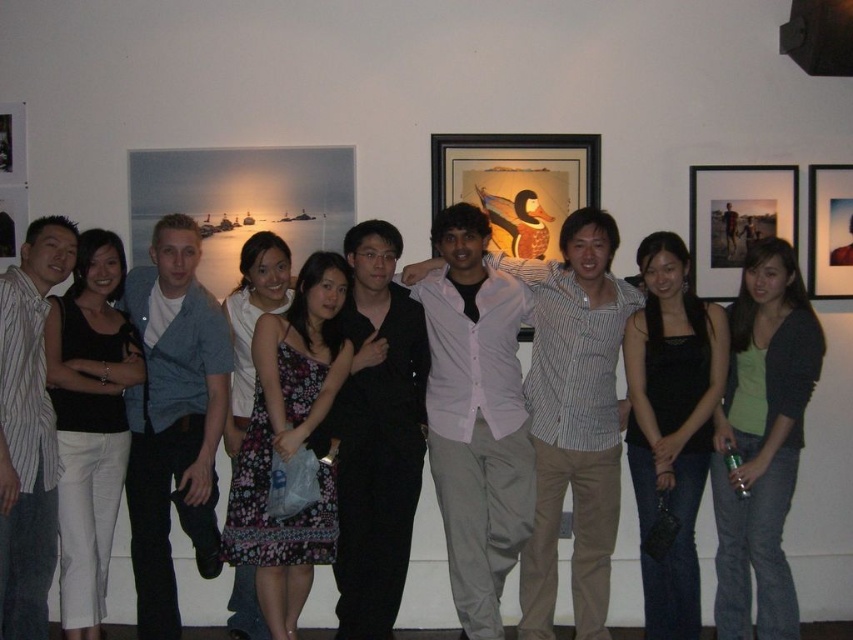
Between pink button-up shirt at center and black satin tank top at center, which one appears on the left side from the viewer's perspective?

pink button-up shirt at center

Is point (622, 321) positioned behind point (676, 468)?

Yes, point (622, 321) is behind point (676, 468).

I want to click on pink button-up shirt at center, so click(x=573, y=419).

Does black satin tank top at center appear under matte black portrait at upper right?

Yes.

Is black satin tank top at center closer to the viewer compared to matte black portrait at upper right?

→ Yes, black satin tank top at center is in front of matte black portrait at upper right.

At what (x,y) coordinates should I click in order to perform the action: click on black satin tank top at center. Please return your answer as a coordinate pair (x, y). Looking at the image, I should click on (671, 426).

Where is `black matte dress shirt at center`? This screenshot has width=853, height=640. black matte dress shirt at center is located at coordinates (378, 435).

From the picture: Between black matte dress shirt at center and striped cotton shirt at left, which one has less height?

A: striped cotton shirt at left is shorter.

You are a GUI agent. You are given a task and a screenshot of the screen. Output one action in this format:
    pyautogui.click(x=<x>, y=<y>)
    Task: Click on the black matte dress shirt at center
    
    Given the screenshot: What is the action you would take?
    pyautogui.click(x=378, y=435)

You are a GUI agent. You are given a task and a screenshot of the screen. Output one action in this format:
    pyautogui.click(x=<x>, y=<y>)
    Task: Click on the black matte dress shirt at center
    This screenshot has width=853, height=640.
    Given the screenshot: What is the action you would take?
    pyautogui.click(x=378, y=435)